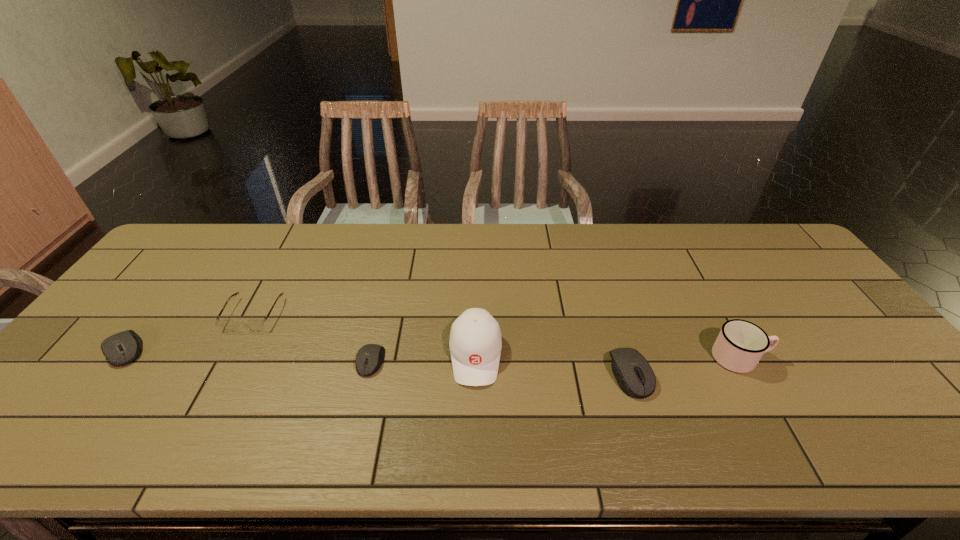
Considering the uniform spacing of computer equipments, where should an additional computer equipment be positioned on the right? Please locate a free spot. Please provide its 2D coordinates. Your answer should be formatted as a tuple, i.e. [(x, y)], where the tuple contains the x and y coordinates of a point satisfying the conditions above.

[(903, 388)]